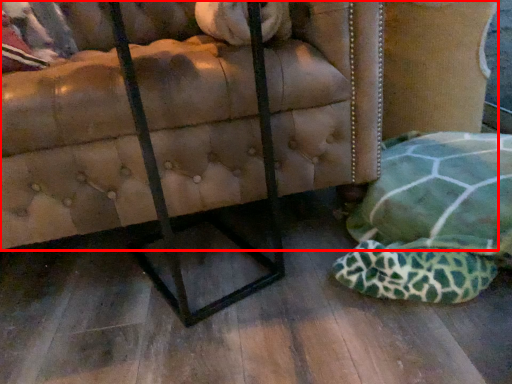
Question: From the image's perspective, where is furniture (annotated by the red box) located relative to swivel chair?

Choices:
 (A) above
 (B) below

Answer: (A)